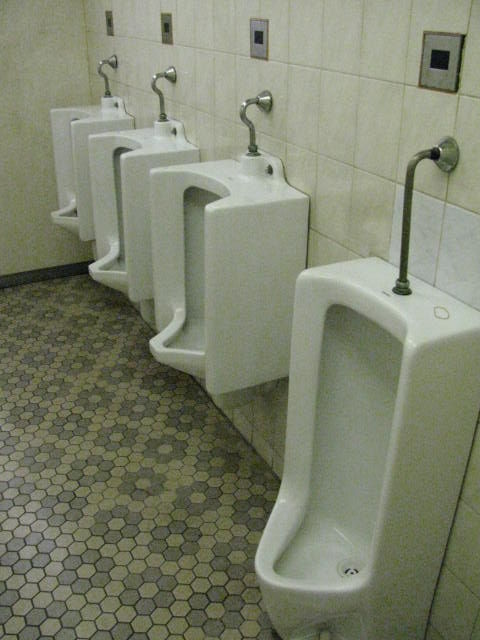
Where is `wall plates above urinals`? wall plates above urinals is located at coordinates (445, 52), (251, 45), (171, 27), (97, 22).